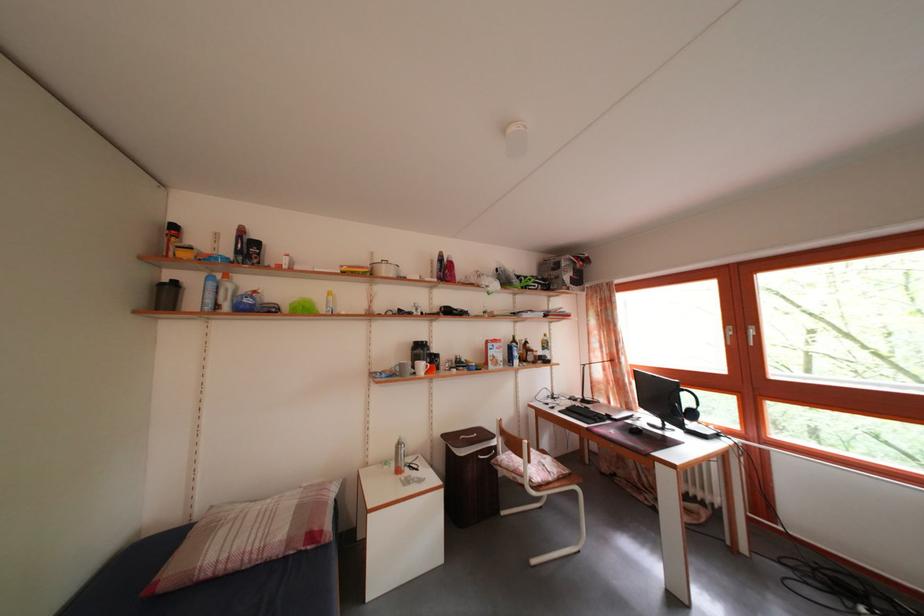
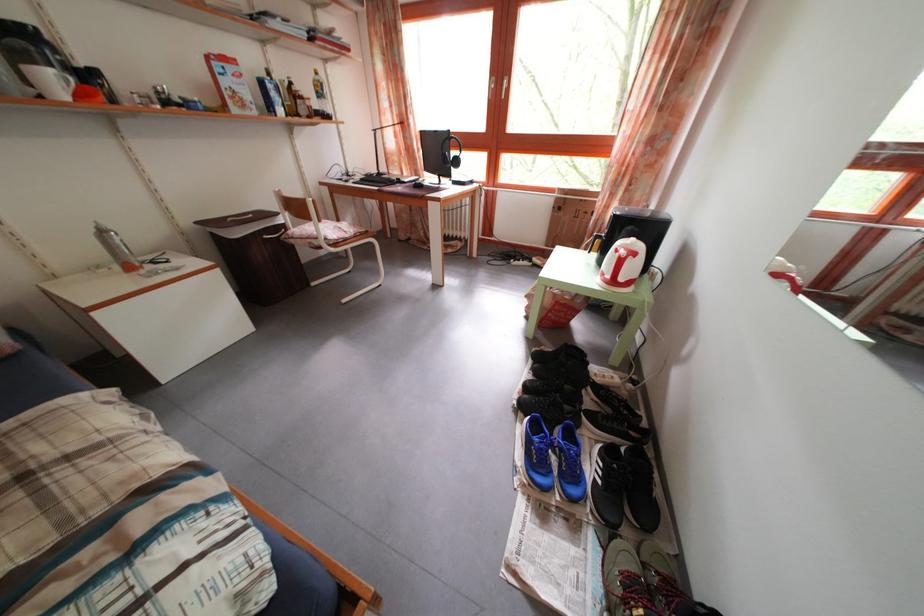
In the second image, find the point that corresponds to (x=553, y=342) in the first image.

(323, 79)